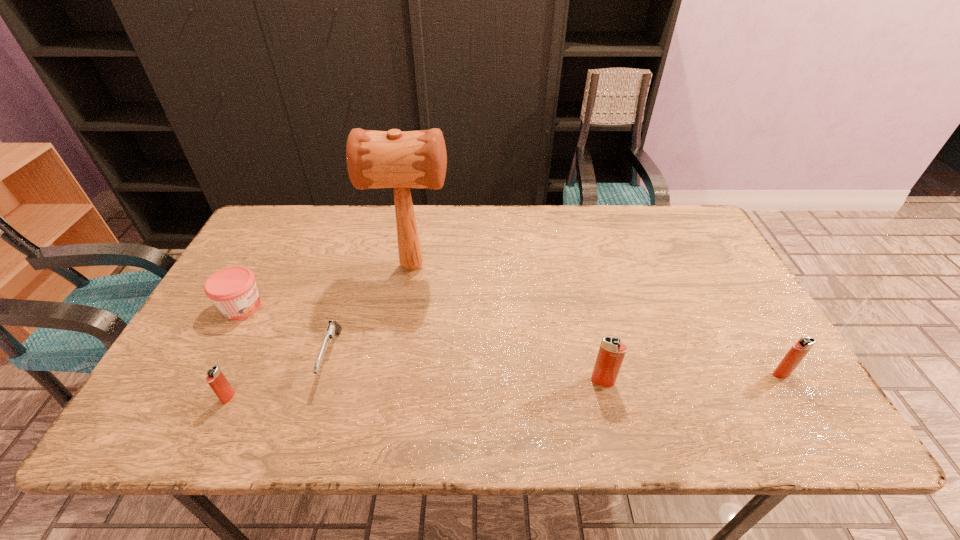
At what (x,y) coordinates should I click in order to perform the action: click on the fifth nearest object. Please return your answer as a coordinate pair (x, y). Image resolution: width=960 pixels, height=540 pixels. Looking at the image, I should click on (233, 290).

Identify the location of the leftmost object. (233, 290).

This screenshot has width=960, height=540. In order to click on vacant area situated 0.350m on the back of the nearest igniter in this screenshot , I will do `click(282, 284)`.

The height and width of the screenshot is (540, 960). In order to click on free space located on the right of the fifth shortest object in this screenshot , I will do `click(636, 381)`.

At what (x,y) coordinates should I click in order to perform the action: click on free space located on the back of the second shortest igniter. Please return your answer as a coordinate pair (x, y). Image resolution: width=960 pixels, height=540 pixels. Looking at the image, I should click on (759, 336).

At what (x,y) coordinates should I click in order to perform the action: click on vacant space located 0.270m on the strike surface of the tallest object. Please return your answer as a coordinate pair (x, y). The image size is (960, 540). Looking at the image, I should click on (544, 266).

This screenshot has width=960, height=540. I want to click on blank space located on the front label of the leftmost object, so click(327, 307).

I want to click on object situated at the far edge, so click(393, 159).

This screenshot has width=960, height=540. What are the coordinates of `pistol located in the near edge section of the desktop` in the screenshot? It's located at (333, 327).

This screenshot has height=540, width=960. I want to click on igniter situated at the left edge, so click(x=217, y=381).